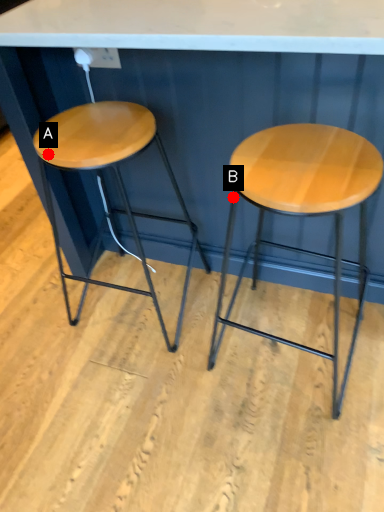
Question: Two points are circled on the image, labeled by A and B beside each circle. Which of the following is the farthest from the observer?

Choices:
 (A) A is further
 (B) B is further

Answer: (B)